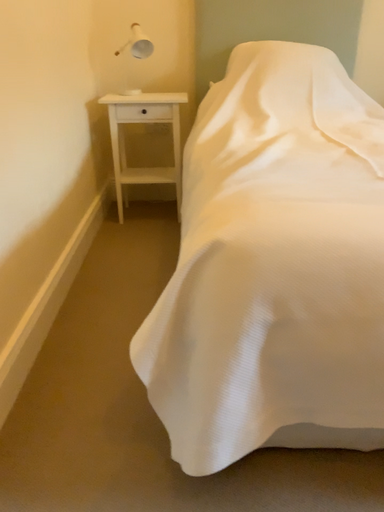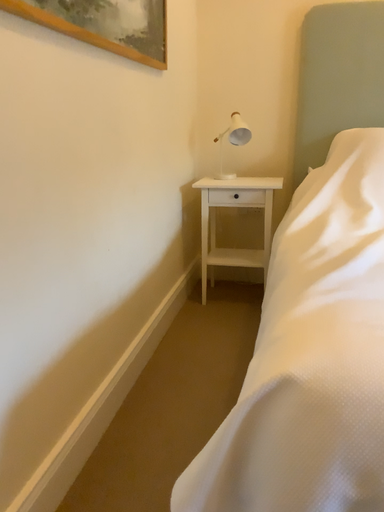
Question: How did the camera likely rotate when shooting the video?

Choices:
 (A) rotated upward
 (B) rotated downward

Answer: (A)